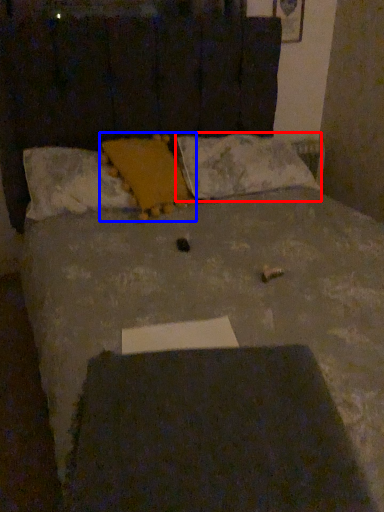
Question: Among these objects, which one is farthest to the camera, pillow (highlighted by a red box) or pillow (highlighted by a blue box)?

Choices:
 (A) pillow
 (B) pillow

Answer: (A)